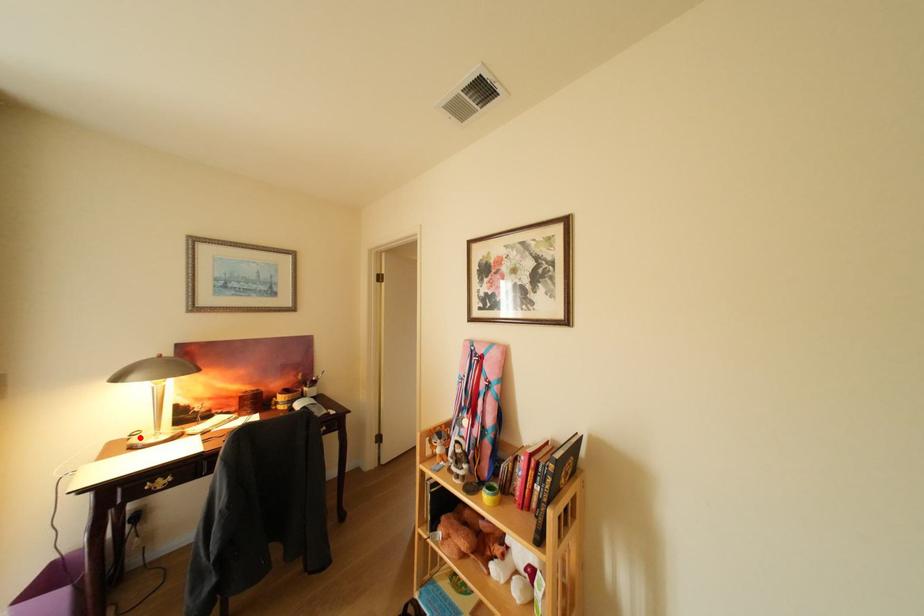
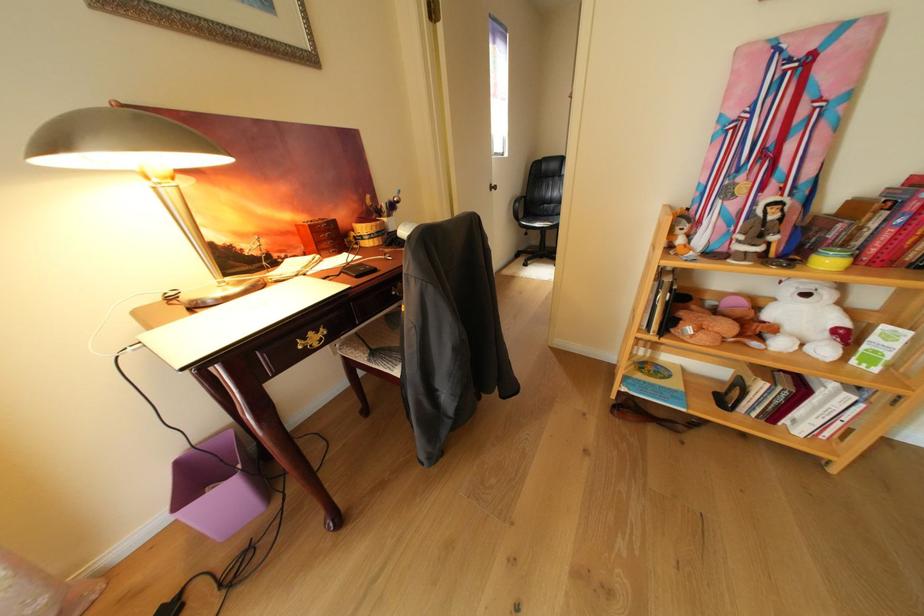
Where in the second image is the point corresponding to the highlighted location from the first image?

(171, 301)